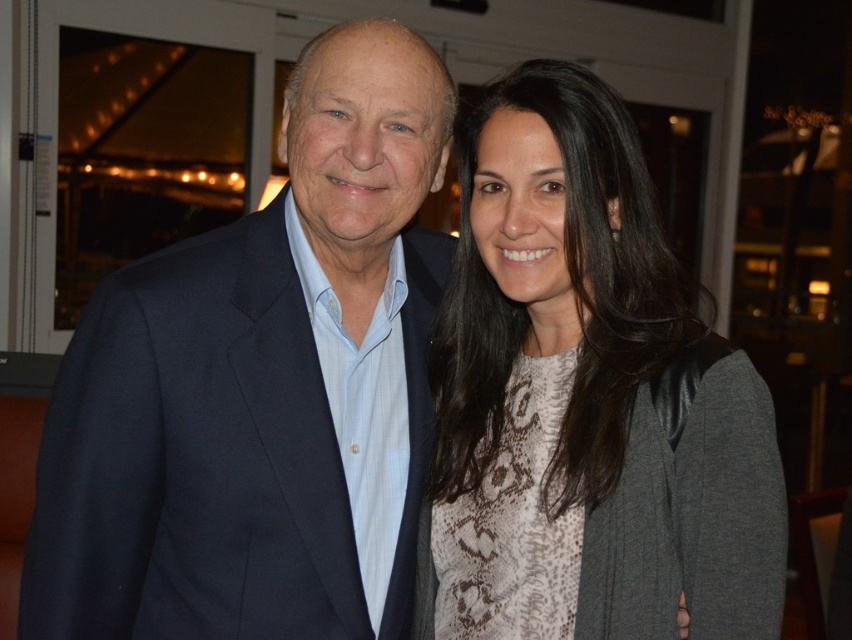
Who is taller, navy blue suit at left or snake print sweater at center?

Standing taller between the two is navy blue suit at left.

Is navy blue suit at left above snake print sweater at center?

No, navy blue suit at left is not above snake print sweater at center.

You are a GUI agent. You are given a task and a screenshot of the screen. Output one action in this format:
    pyautogui.click(x=<x>, y=<y>)
    Task: Click on the navy blue suit at left
    The height and width of the screenshot is (640, 852).
    Given the screenshot: What is the action you would take?
    pyautogui.click(x=260, y=388)